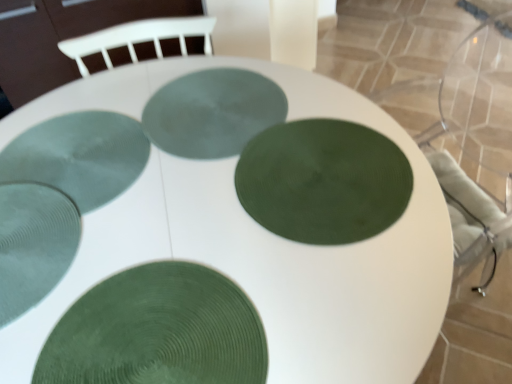
The width and height of the screenshot is (512, 384). Find the location of `vacant space that is in between green textured glass plate at center, arranged as the fourth glass plate when viewed from the front, and green textured plate at center, which is the 5th glass plate from back to front`. vacant space that is in between green textured glass plate at center, arranged as the fourth glass plate when viewed from the front, and green textured plate at center, which is the 5th glass plate from back to front is located at coordinates (131, 240).